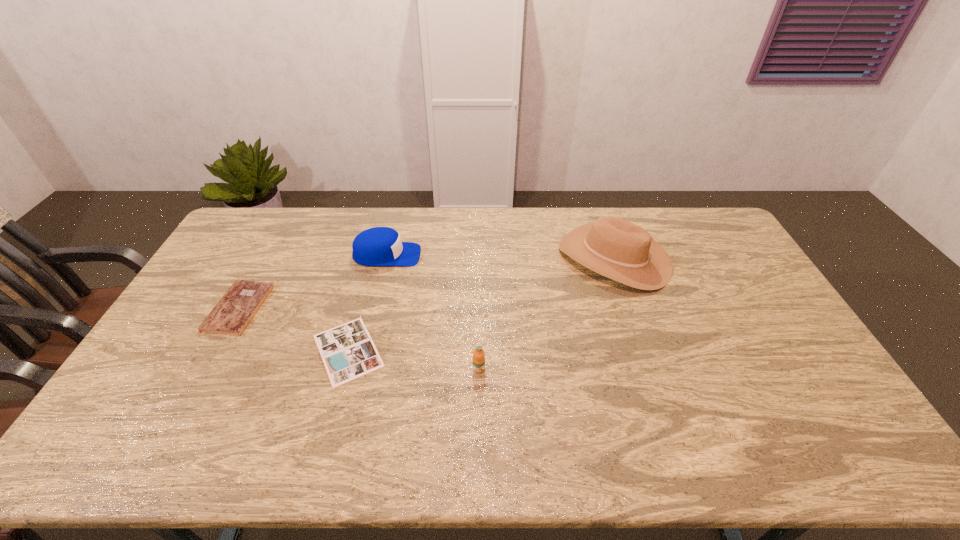
Identify the location of cowboy hat. This screenshot has height=540, width=960. (611, 246).

The image size is (960, 540). I want to click on the rightmost object, so 611,246.

Locate an element on the screen. baseball cap is located at coordinates (379, 246).

The height and width of the screenshot is (540, 960). Identify the location of orange juice. (478, 354).

Locate an element on the screen. Bible is located at coordinates (232, 314).

Locate an element on the screen. Image resolution: width=960 pixels, height=540 pixels. the fourth tallest object is located at coordinates (232, 314).

Find the location of `the shortest object`. the shortest object is located at coordinates (348, 352).

Locate an element on the screen. free space located 0.270m on the right of the tallest object is located at coordinates (743, 258).

The image size is (960, 540). In order to click on vacant region located on the front-facing side of the baseball cap in this screenshot , I will do `click(479, 255)`.

I want to click on blank space located 0.170m on the label of the orange juice, so click(479, 432).